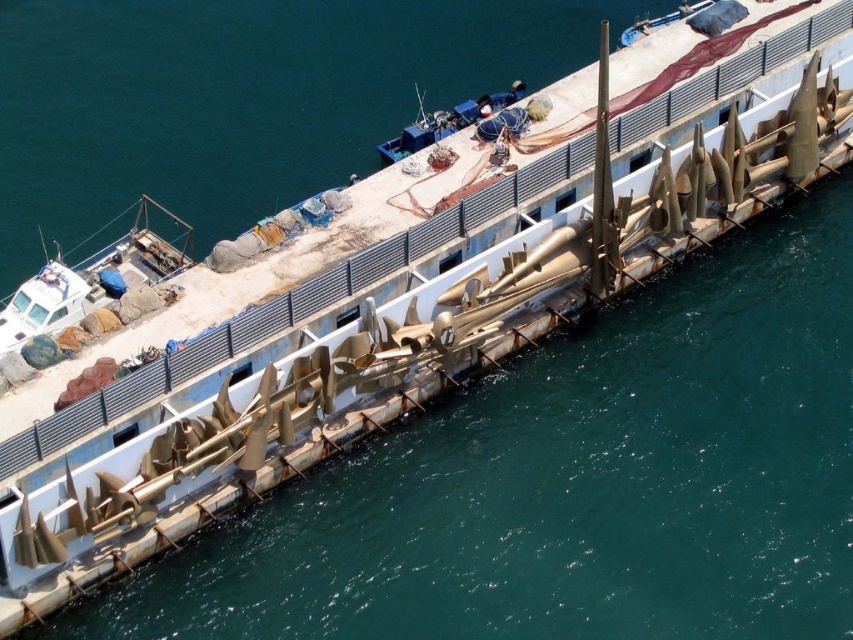
Does white matte boat at left have a smaller size compared to blue plastic boat at upper center?

Actually, white matte boat at left might be larger than blue plastic boat at upper center.

Which is above, white matte boat at left or blue plastic boat at upper center?

blue plastic boat at upper center is above.

Locate an element on the screen. The height and width of the screenshot is (640, 853). white matte boat at left is located at coordinates (91, 280).

Identify the location of white matte boat at left. The image size is (853, 640). (91, 280).